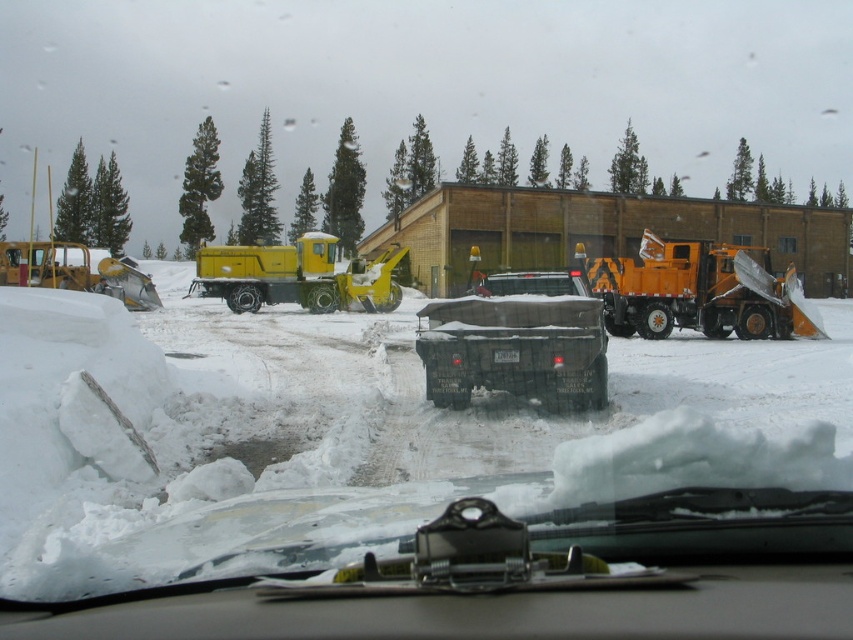
Question: Which object appears farthest from the camera in this image?

Choices:
 (A) orange metallic snowplow at right
 (B) yellow rubber snowplow at left

Answer: (B)

Question: Which object is farther from the camera taking this photo?

Choices:
 (A) yellow matte truck at center
 (B) orange metallic snowplow at right

Answer: (A)

Question: Does orange metallic snowplow at right lie behind yellow rubber snowplow at left?

Choices:
 (A) no
 (B) yes

Answer: (A)

Question: Can you confirm if black matte truck at center is positioned to the left of yellow matte truck at center?

Choices:
 (A) yes
 (B) no

Answer: (B)

Question: Is white fluffy snow at center bigger than orange metallic snowplow at right?

Choices:
 (A) no
 (B) yes

Answer: (A)

Question: Considering the real-world distances, which object is farthest from the white fluffy snow at center?

Choices:
 (A) orange metallic snowplow at right
 (B) yellow rubber snowplow at left
 (C) yellow matte truck at center

Answer: (C)